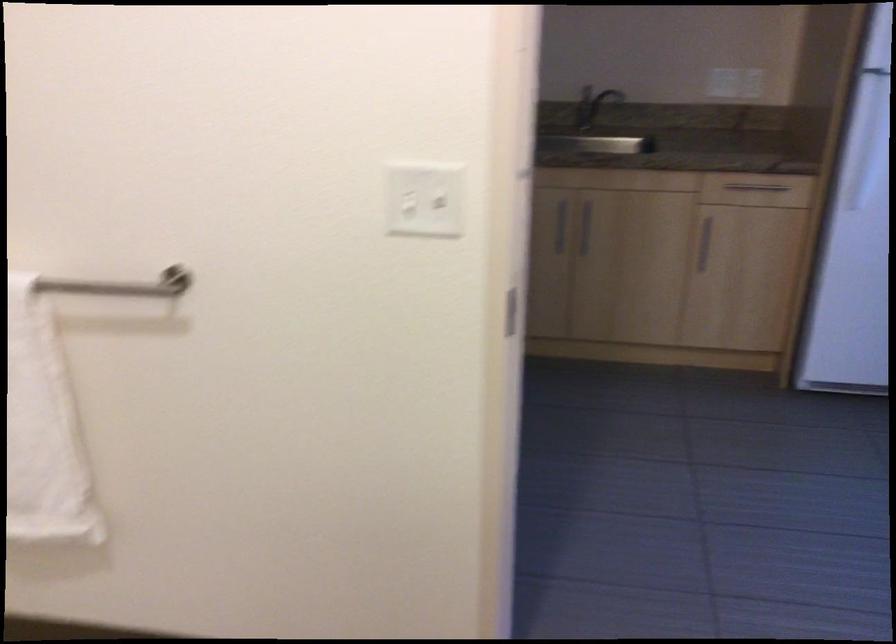
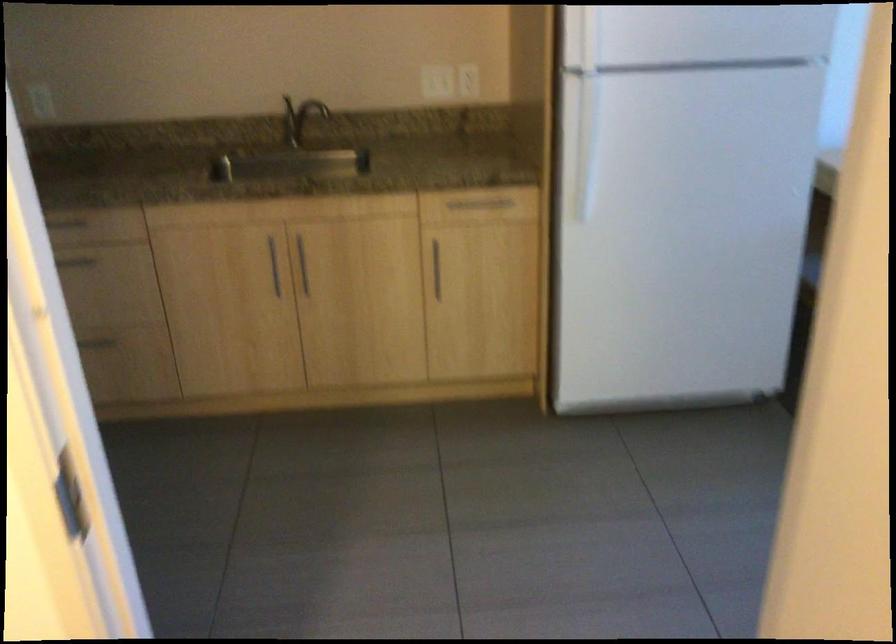
In the second image, find the point that corresponds to point (552, 223) in the first image.

(273, 265)